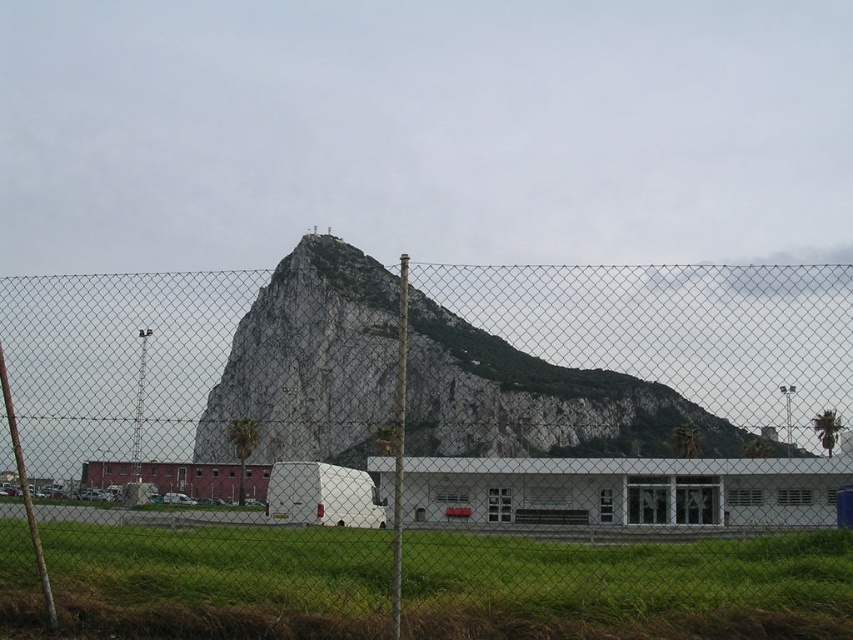
You are standing in a park and see the green grass at lower center and the rocky gray mountain at center. Which object takes up more space in the image?

The rocky gray mountain at center takes up more space in the image than the green grass at lower center because the green grass at lower center is smaller than the rocky gray mountain at center.